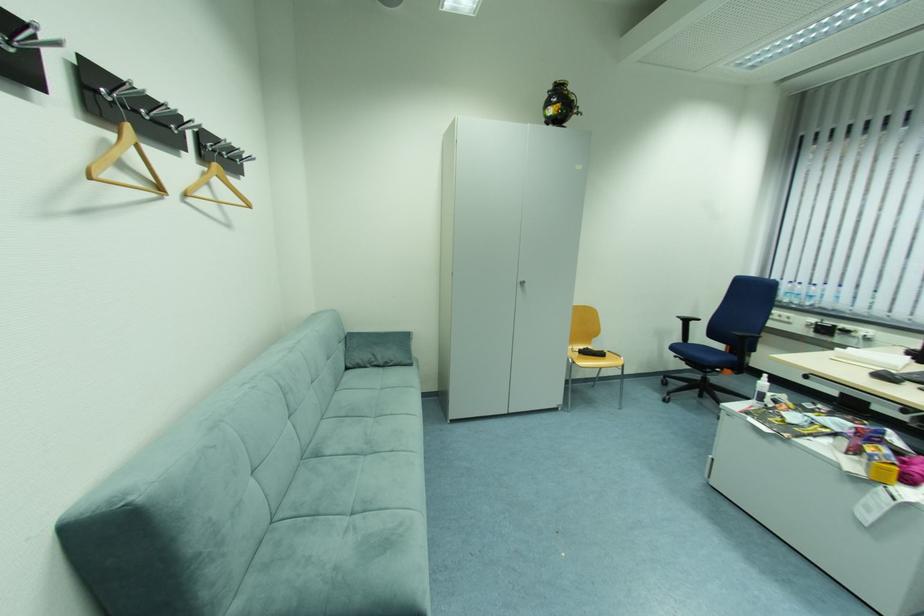
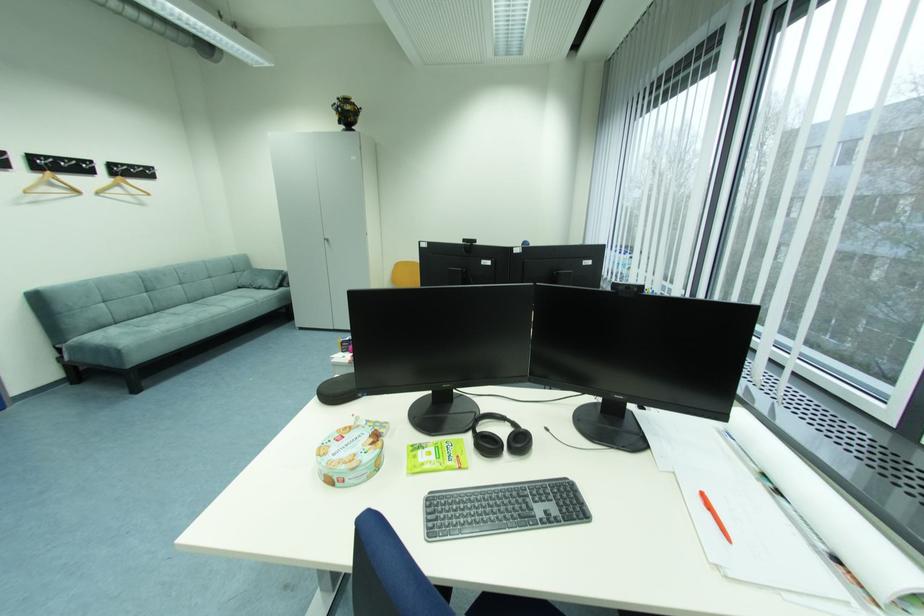
Question: I am providing you with two images of the same scene from different viewpoints. Which of the following objects are not visible in image2?

Choices:
 (A) woven pen holder
 (B) white spray bottle
 (C) sofa armrest
 (D) round cookie tin

Answer: (B)